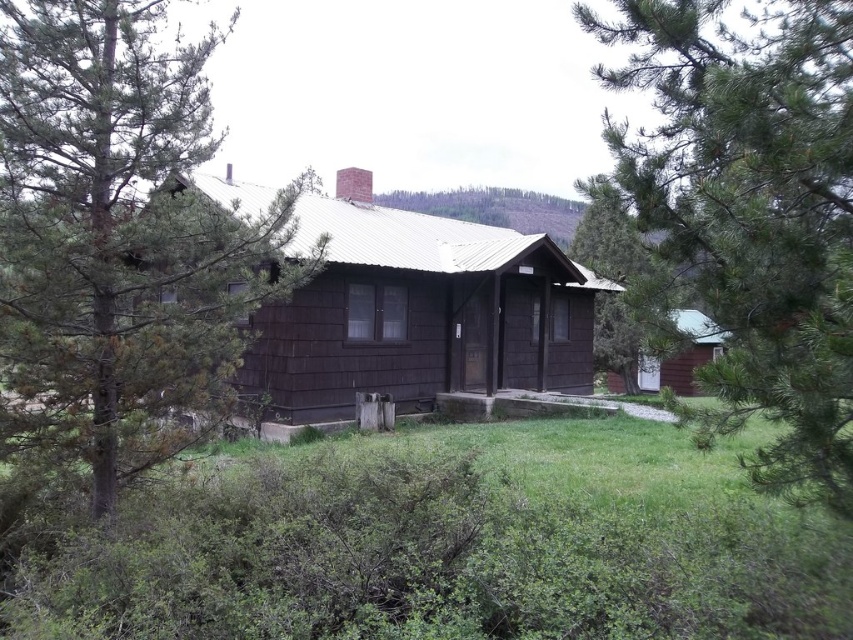
Is green pine tree at upper left behind green textured tree at center?

No.

Is point (798, 461) more distant than point (585, 262)?

That is False.

Find the location of a particular element. green pine tree at upper left is located at coordinates [x=752, y=211].

Is green pine tree at upper left to the right of dark wood cabin at center from the viewer's perspective?

Yes, green pine tree at upper left is to the right of dark wood cabin at center.

Does green pine tree at upper left have a greater width compared to dark wood cabin at center?

No.

Where is `green pine tree at upper left`? Image resolution: width=853 pixels, height=640 pixels. green pine tree at upper left is located at coordinates (752, 211).

The width and height of the screenshot is (853, 640). Identify the location of green pine tree at upper left. (752, 211).

Is dark wood cabin at center shorter than green textured tree at center?

Yes.

Does dark wood cabin at center appear on the left side of green textured tree at center?

Yes, dark wood cabin at center is to the left of green textured tree at center.

Does point (280, 301) come farther from viewer compared to point (587, 256)?

No, it is not.

I want to click on dark wood cabin at center, so click(x=416, y=312).